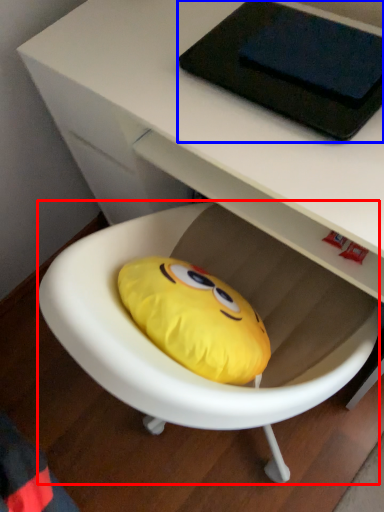
Question: Which object is closer to the camera taking this photo, bean bag chair (highlighted by a red box) or tablet computer (highlighted by a blue box)?

Choices:
 (A) bean bag chair
 (B) tablet computer

Answer: (A)